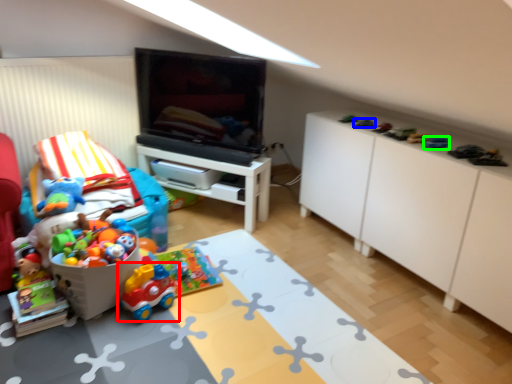
Question: Considering the real-world distances, which object is farthest from toy (highlighted by a red box)? toy (highlighted by a blue box) or toy (highlighted by a green box)?

Choices:
 (A) toy
 (B) toy

Answer: (B)